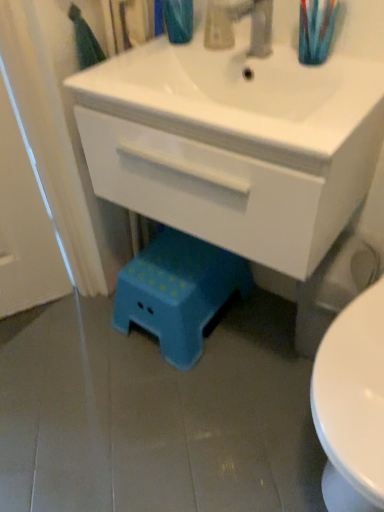
What are the coordinates of `free space to the left of blue plastic step stool at lower center` in the screenshot? It's located at (80, 345).